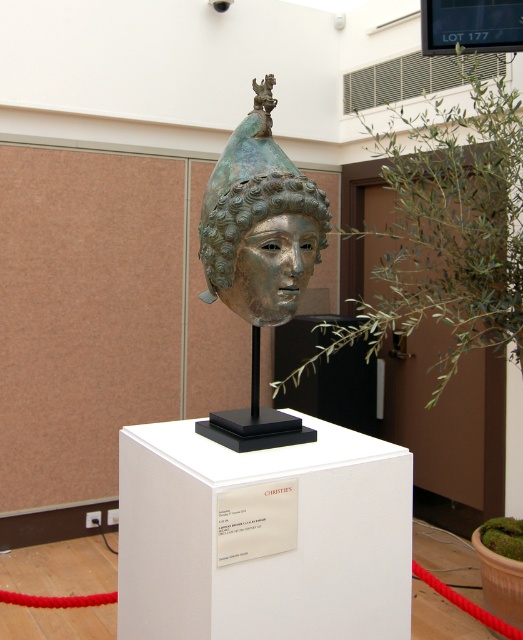
Question: Is green leafy plant at center in front of shiny silver mask at center?

Choices:
 (A) no
 (B) yes

Answer: (A)

Question: Which point is closer to the camera?

Choices:
 (A) shiny silver mask at center
 (B) green leafy plant at center

Answer: (A)

Question: Which is nearer to the green leafy plant at center?

Choices:
 (A) shiny bronze mask at center
 (B) shiny silver mask at center

Answer: (A)

Question: From the image, what is the correct spatial relationship of green leafy plant at center in relation to shiny bronze mask at center?

Choices:
 (A) above
 (B) below

Answer: (B)

Question: Does green leafy plant at center appear over shiny bronze mask at center?

Choices:
 (A) yes
 (B) no

Answer: (B)

Question: Which object is the closest to the green leafy plant at center?

Choices:
 (A) shiny bronze mask at center
 (B) shiny silver mask at center

Answer: (A)